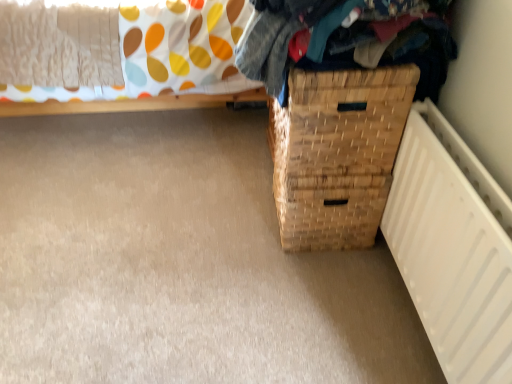
The image size is (512, 384). What do you see at coordinates (453, 248) in the screenshot?
I see `white matte radiator at lower right` at bounding box center [453, 248].

Find the location of `woven fabric clothes at upper right`. woven fabric clothes at upper right is located at coordinates (345, 40).

What are the coordinates of `woven wood basket at lower right` in the screenshot? It's located at (337, 153).

Locate an element on the screen. woven wood basket at lower right is located at coordinates (121, 56).

Find the location of a particular element. white matte radiator at lower right is located at coordinates (453, 248).

How far apart are white matte radiator at lower right and woven wood basket at lower right?

1.25 meters.

How many degrees apart are the facing directions of white matte radiator at lower right and woven wood basket at lower right?

The facing directions of white matte radiator at lower right and woven wood basket at lower right are 0.286 degrees apart.

From the image's perspective, between white matte radiator at lower right and woven wood basket at lower right, which one is located above?

woven wood basket at lower right.

Can we say white matte radiator at lower right lies outside woven wood basket at lower right?

Yes, white matte radiator at lower right is located beyond the bounds of woven wood basket at lower right.

From a real-world perspective, is woven wood basket at lower right positioned above or below woven wood basket at lower right?

From a real-world perspective, woven wood basket at lower right is physically above woven wood basket at lower right.

Can you confirm if woven wood basket at lower right is thinner than woven wood basket at lower right?

Incorrect, the width of woven wood basket at lower right is not less than that of woven wood basket at lower right.

Which object is more forward, woven wood basket at lower right or woven wood basket at lower right?

woven wood basket at lower right.

Which is closer, (162, 38) or (287, 130)?

Point (162, 38).

Can you see woven wood basket at lower right touching white matte radiator at lower right?

No, woven wood basket at lower right is not in contact with white matte radiator at lower right.

Could white matte radiator at lower right be considered to be inside woven wood basket at lower right?

No, white matte radiator at lower right is not a part of woven wood basket at lower right.

Which of these two, woven wood basket at lower right or white matte radiator at lower right, stands shorter?

white matte radiator at lower right.

From the image's perspective, between woven wood basket at lower right and woven wood basket at lower right, who is located below?

woven wood basket at lower right is shown below in the image.

Is woven wood basket at lower right wider or thinner than woven wood basket at lower right?

woven wood basket at lower right is thinner than woven wood basket at lower right.

Is point (391, 77) less distant than point (166, 24)?

That is True.

Does woven fabric clothes at upper right have a lesser height compared to white matte radiator at lower right?

Yes.

Can you confirm if woven fabric clothes at upper right is smaller than white matte radiator at lower right?

No.

Which is in front, woven fabric clothes at upper right or white matte radiator at lower right?

Positioned in front is white matte radiator at lower right.

Is the depth of white matte radiator at lower right greater than that of woven wood basket at lower right?

No, white matte radiator at lower right is closer to the viewer.

From their relative heights in the image, would you say white matte radiator at lower right is taller or shorter than woven wood basket at lower right?

Clearly, white matte radiator at lower right is taller compared to woven wood basket at lower right.

How many degrees apart are the facing directions of white matte radiator at lower right and woven wood basket at lower right?

They differ by 0.286 degrees in their facing directions.

From a real-world perspective, which is physically below, white matte radiator at lower right or woven wood basket at lower right?

woven wood basket at lower right is physically lower.

Can we say woven fabric clothes at upper right lies outside woven wood basket at lower right?

woven fabric clothes at upper right is positioned outside woven wood basket at lower right.

Identify the location of clothing above the woven wood basket at lower right (from a real-world perspective). (345, 40).

Can you tell me how much woven fabric clothes at upper right and woven wood basket at lower right differ in facing direction?

The angle between the facing direction of woven fabric clothes at upper right and the facing direction of woven wood basket at lower right is 0.000778 degrees.

From the image's perspective, which is above, woven fabric clothes at upper right or woven wood basket at lower right?

woven fabric clothes at upper right appears higher in the image.

Identify the location of radiator in front of the woven wood basket at lower right. The width and height of the screenshot is (512, 384). (453, 248).

Image resolution: width=512 pixels, height=384 pixels. Find the location of `furniture behind the woven wood basket at lower right`. furniture behind the woven wood basket at lower right is located at coordinates point(121,56).

Considering their positions, is woven wood basket at lower right positioned closer to woven wood basket at lower right than white matte radiator at lower right?

white matte radiator at lower right.

Based on their spatial positions, is woven fabric clothes at upper right or woven wood basket at lower right further from woven wood basket at lower right?

woven wood basket at lower right.

Estimate the real-world distances between objects in this image. Which object is closer to woven wood basket at lower right, woven wood basket at lower right or woven fabric clothes at upper right?

woven wood basket at lower right.

Estimate the real-world distances between objects in this image. Which object is closer to woven fabric clothes at upper right, white matte radiator at lower right or woven wood basket at lower right?

white matte radiator at lower right is closer to woven fabric clothes at upper right.

When comparing their distances from white matte radiator at lower right, does woven wood basket at lower right or woven fabric clothes at upper right seem further?

woven fabric clothes at upper right.

Which object lies further to the anchor point woven wood basket at lower right, woven fabric clothes at upper right or woven wood basket at lower right?

woven fabric clothes at upper right is positioned further to the anchor woven wood basket at lower right.

Which object lies nearer to the anchor point woven fabric clothes at upper right, woven wood basket at lower right or woven wood basket at lower right?

woven wood basket at lower right is positioned closer to the anchor woven fabric clothes at upper right.

Looking at the image, which one is located further to woven wood basket at lower right, white matte radiator at lower right or woven wood basket at lower right?

Among the two, white matte radiator at lower right is located further to woven wood basket at lower right.

Where is `clothing between woven wood basket at lower right and white matte radiator at lower right`? This screenshot has height=384, width=512. clothing between woven wood basket at lower right and white matte radiator at lower right is located at coordinates (345, 40).

Where is `basket container located between woven wood basket at lower right and white matte radiator at lower right in the left-right direction`? This screenshot has width=512, height=384. basket container located between woven wood basket at lower right and white matte radiator at lower right in the left-right direction is located at coordinates (337, 153).

Locate an element on the screen. The image size is (512, 384). clothing located between woven wood basket at lower right and woven wood basket at lower right in the left-right direction is located at coordinates (345, 40).

At what (x,y) coordinates should I click in order to perform the action: click on basket container between woven fabric clothes at upper right and white matte radiator at lower right from top to bottom. Please return your answer as a coordinate pair (x, y). The width and height of the screenshot is (512, 384). Looking at the image, I should click on (337, 153).